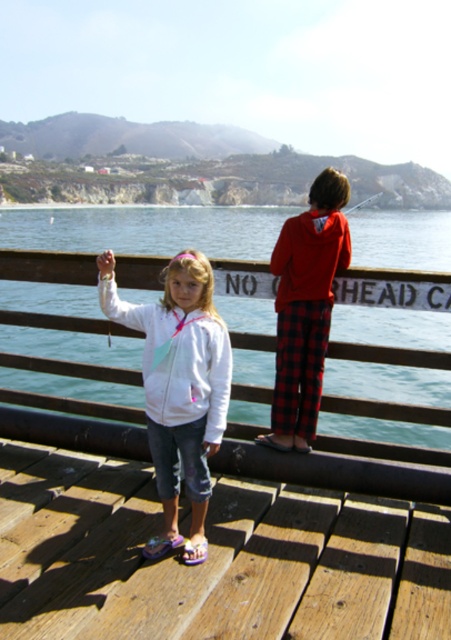
You are a photographer trying to capture a shot of the wooden at center and the red flannel pants at center. If you want to frame both subjects in your camera viewfinder, which object should you position first to ensure they both fit in the frame?

You should position the wooden at center first since it is to the left of the red flannel pants at center, allowing you to adjust the frame to include both objects from left to right.

You are a photographer trying to capture a shot of the wooden at center and the red flannel pants at center. If you want to ensure both objects are fully visible in your frame, which object should you position closer to the camera to avoid cropping?

You should position the wooden at center closer to the camera because it is wider than the red flannel pants at center, ensuring both fit within the frame without cropping.

You are a photographer trying to capture a closeup of the wooden at center and the red flannel pants at center. Which object should you zoom in on first to ensure both are in focus?

The wooden at center is bigger than the red flannel pants at center, so you should zoom in on the wooden at center first to ensure both are in focus.